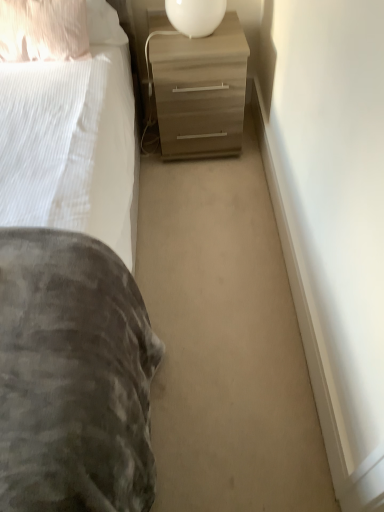
Question: Looking at the image, does white glossy table lamp at upper center seem bigger or smaller compared to pillow at upper left?

Choices:
 (A) small
 (B) big

Answer: (A)

Question: In the image, is white glossy table lamp at upper center positioned in front of or behind pillow at upper left?

Choices:
 (A) behind
 (B) front

Answer: (A)

Question: Which of these objects is positioned farthest from the pillow at upper left?

Choices:
 (A) white glossy table lamp at upper center
 (B) matte wood chest of drawers at center

Answer: (A)

Question: Which is nearer to the white glossy table lamp at upper center?

Choices:
 (A) matte wood chest of drawers at center
 (B) pillow at upper left

Answer: (A)